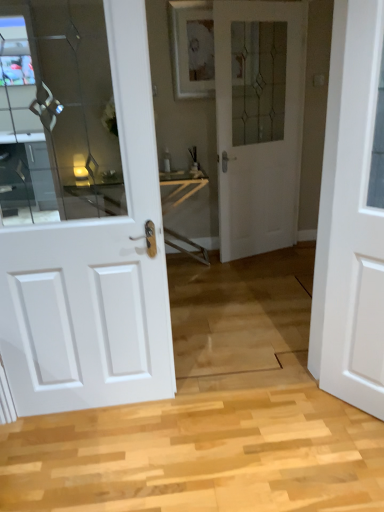
In order to click on vacant space underneath white matte door at right, marked as the first door in a right-to-left arrangement (from a real-world perspective) in this screenshot , I will do `click(343, 407)`.